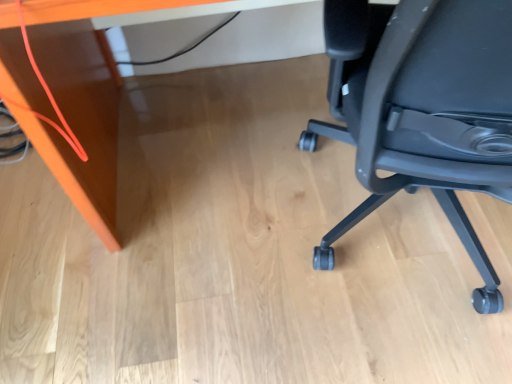
Identify the location of vacant area that lies between black plastic chair at right and matte orange desk at upper left. (229, 269).